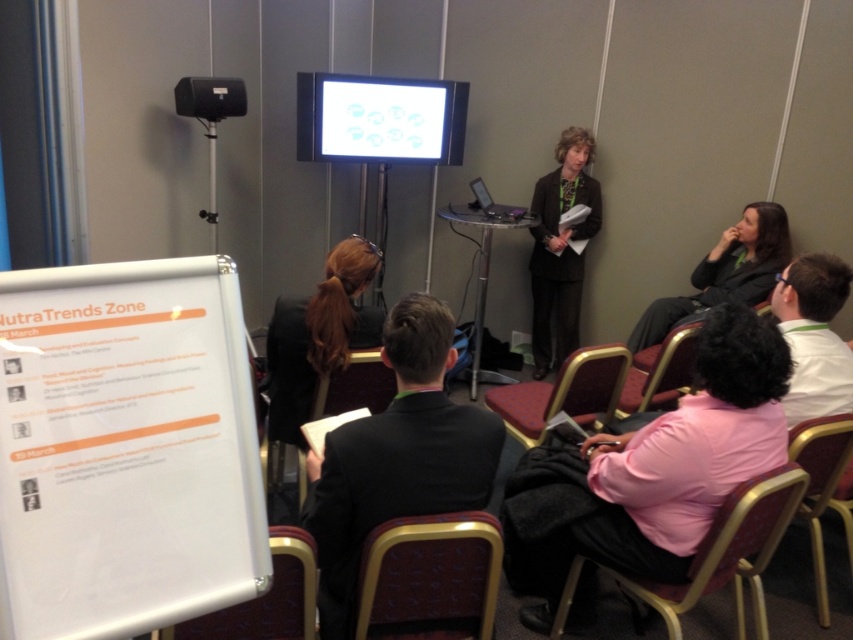
Question: Which object appears farthest from the camera in this image?

Choices:
 (A) white paperboard at left
 (B) maroon fabric chair at center
 (C) wooden textured chair at lower center
 (D) white glossy screen at upper center

Answer: (D)

Question: Is the position of black suit at center less distant than that of metallic gold chair at lower center?

Choices:
 (A) yes
 (B) no

Answer: (A)

Question: From the image, what is the correct spatial relationship of metallic gold chair at lower center in relation to velvet-like red chair at lower center?

Choices:
 (A) left
 (B) right

Answer: (B)

Question: Which is nearer to the white glossy screen at upper center?

Choices:
 (A) metallic fabric chair at lower center
 (B) wooden textured chair at lower center

Answer: (B)

Question: Can you confirm if metallic fabric chair at lower center is positioned to the left of metallic gold chair at lower right?

Choices:
 (A) no
 (B) yes

Answer: (B)

Question: Which of the following is the closest to the observer?

Choices:
 (A) brown hair at center
 (B) white glossy screen at upper center

Answer: (A)